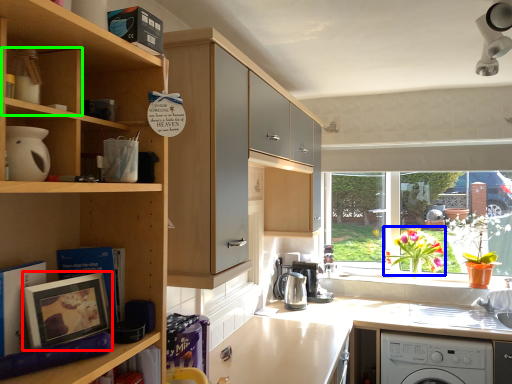
Question: Which is farther away from picture frame (highlighted by a red box)? flower (highlighted by a blue box) or cabinet (highlighted by a green box)?

Choices:
 (A) flower
 (B) cabinet

Answer: (A)